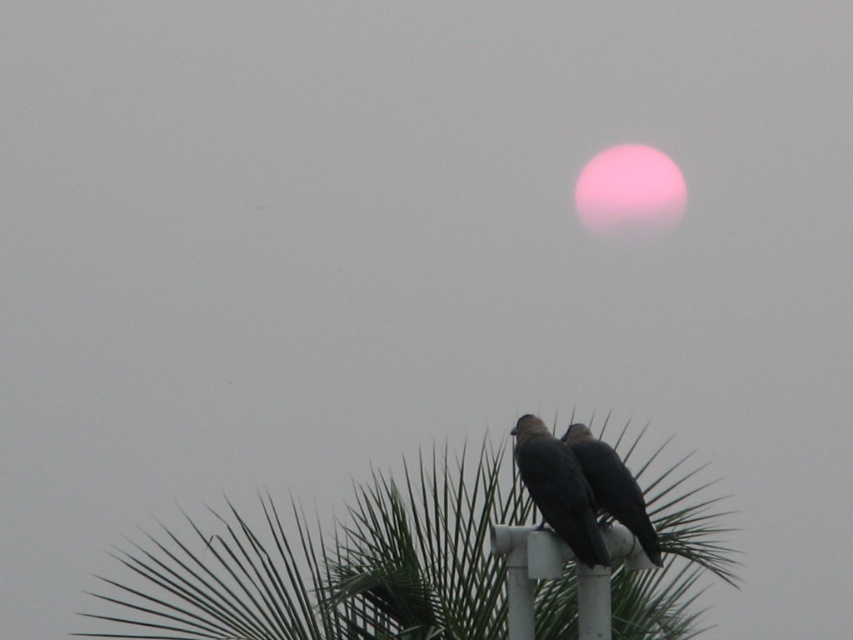
Question: Which object is closer to the camera taking this photo?

Choices:
 (A) shiny black bird at center
 (B) green leafy tree at center

Answer: (A)

Question: Which point appears closest to the camera in this image?

Choices:
 (A) (357, 561)
 (B) (515, 456)
 (C) (598, 476)

Answer: (C)

Question: Which point is farther from the camera taking this photo?

Choices:
 (A) (538, 490)
 (B) (608, 454)

Answer: (B)

Question: Does green leafy tree at center appear under dark gray feathers at center?

Choices:
 (A) yes
 (B) no

Answer: (A)

Question: Is dark gray feathers at center further to the viewer compared to shiny black bird at center?

Choices:
 (A) no
 (B) yes

Answer: (A)

Question: Is green leafy tree at center in front of dark gray feathers at center?

Choices:
 (A) no
 (B) yes

Answer: (A)